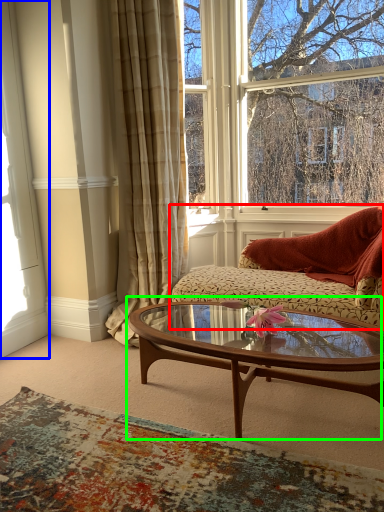
Question: Considering the real-world distances, which object is closest to studio couch (highlighted by a red box)? window frame (highlighted by a blue box) or coffee table (highlighted by a green box).

Choices:
 (A) window frame
 (B) coffee table

Answer: (B)